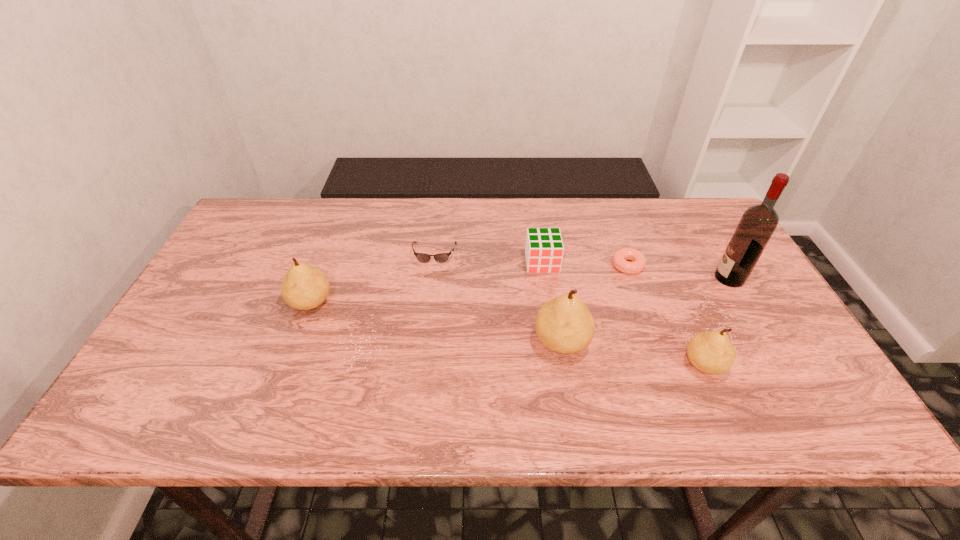
Locate an element on the screen. The height and width of the screenshot is (540, 960). free location located 0.350m on the front-facing side of the sunglasses is located at coordinates (421, 370).

At what (x,y) coordinates should I click in order to perform the action: click on object that is positioned at the far edge. Please return your answer as a coordinate pair (x, y). Looking at the image, I should click on (421, 257).

The width and height of the screenshot is (960, 540). In order to click on object that is at the right edge in this screenshot , I will do `click(758, 223)`.

Where is `vacant space at the far edge of the desktop`? The image size is (960, 540). vacant space at the far edge of the desktop is located at coordinates (505, 218).

Find the location of a particular element. vacant area at the near edge of the desktop is located at coordinates (468, 369).

Locate an element on the screen. vacant space at the left edge of the desktop is located at coordinates (228, 259).

Identify the location of vacant region at the right edge. (740, 299).

The height and width of the screenshot is (540, 960). I want to click on vacant region at the far left corner of the desktop, so click(x=263, y=208).

Image resolution: width=960 pixels, height=540 pixels. Find the location of `vacant space at the near left corner of the desktop`. vacant space at the near left corner of the desktop is located at coordinates (x=155, y=369).

Find the location of `blank region between the second pear from left to right and the second object from left to right`. blank region between the second pear from left to right and the second object from left to right is located at coordinates (498, 298).